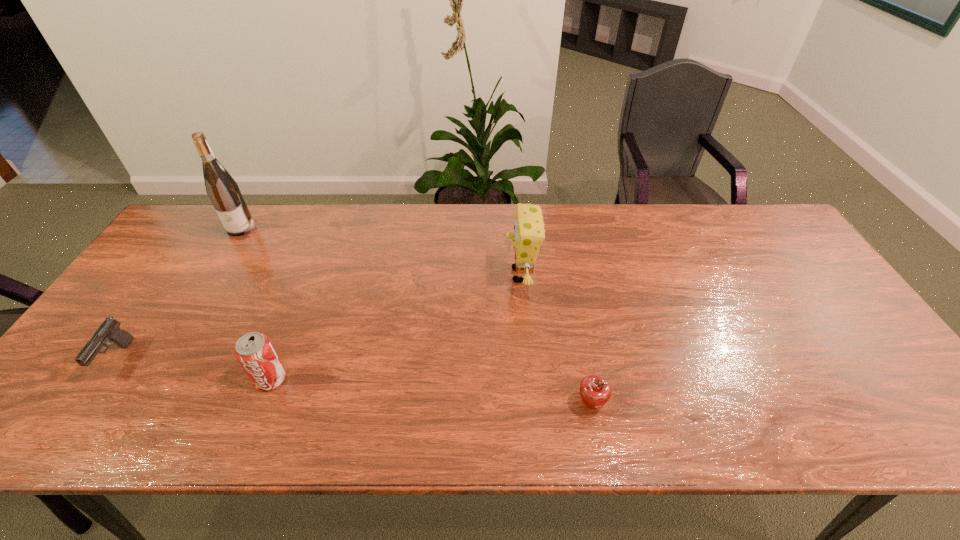
This screenshot has height=540, width=960. In order to click on object situated at the far left corner in this screenshot , I will do `click(223, 191)`.

Locate an element on the screen. Image resolution: width=960 pixels, height=540 pixels. vacant region at the far edge is located at coordinates (602, 233).

Identify the location of blank space at the near edge of the desktop. (254, 435).

In the image, there is a desktop. Where is `vacant area at the right edge`? vacant area at the right edge is located at coordinates (796, 262).

Identify the location of blank area at the far right corner. Image resolution: width=960 pixels, height=540 pixels. (782, 245).

What are the coordinates of `vacant space that is in between the soda can and the apple` in the screenshot? It's located at (431, 392).

This screenshot has width=960, height=540. In order to click on vacant area that lies between the second object from right to left and the rightmost object in this screenshot , I will do `click(556, 339)`.

Find the location of a particular element. This screenshot has width=960, height=540. vacant point located between the tallest object and the third tallest object is located at coordinates (256, 303).

Find the location of a particular element. empty space that is in between the third shortest object and the pistol is located at coordinates (194, 369).

This screenshot has width=960, height=540. Identify the location of free space between the third object from right to left and the leftmost object. 194,369.